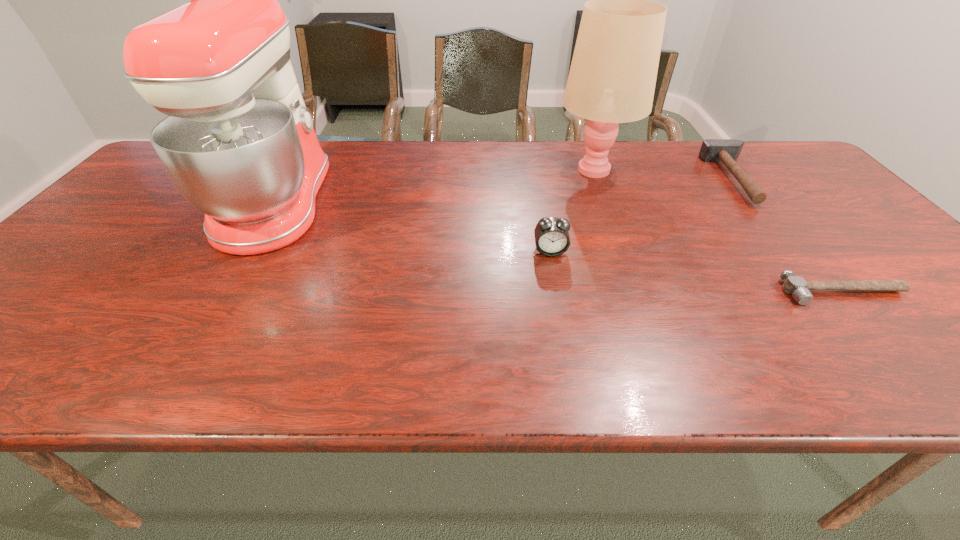
At what (x,y) coordinates should I click in order to perform the action: click on free point at the near edge. Please return your answer as a coordinate pair (x, y). This screenshot has height=540, width=960. Looking at the image, I should click on (732, 354).

I want to click on free space at the left edge of the desktop, so click(x=51, y=299).

You are a GUI agent. You are given a task and a screenshot of the screen. Output one action in this format:
    pyautogui.click(x=<x>, y=<y>)
    Task: Click on the vacant space at the right edge of the desktop
    The image size is (960, 540).
    Given the screenshot: What is the action you would take?
    pyautogui.click(x=886, y=248)

Where is `free space at the far right corner of the desktop`? free space at the far right corner of the desktop is located at coordinates (759, 144).

You are a GUI agent. You are given a task and a screenshot of the screen. Output one action in this format:
    pyautogui.click(x=<x>, y=<y>)
    Task: Click on the unoccupied area between the farther hammer and the third shortest object
    This screenshot has height=540, width=960.
    Given the screenshot: What is the action you would take?
    pyautogui.click(x=643, y=215)

This screenshot has width=960, height=540. In order to click on empty space that is in between the nearest object and the lampshade in this screenshot , I will do `click(718, 230)`.

The width and height of the screenshot is (960, 540). Find the location of `empty space that is in between the taller hammer and the third object from left to right`. empty space that is in between the taller hammer and the third object from left to right is located at coordinates (665, 174).

Where is `vacant space in between the leftmost object and the taller hammer`? Image resolution: width=960 pixels, height=540 pixels. vacant space in between the leftmost object and the taller hammer is located at coordinates (506, 191).

Find the location of a particular element. Image resolution: width=960 pixels, height=540 pixels. free space that is in between the taller hammer and the mixer is located at coordinates (506, 191).

What are the coordinates of `unoccupied position between the nearest object and the farther hammer` in the screenshot? It's located at (789, 235).